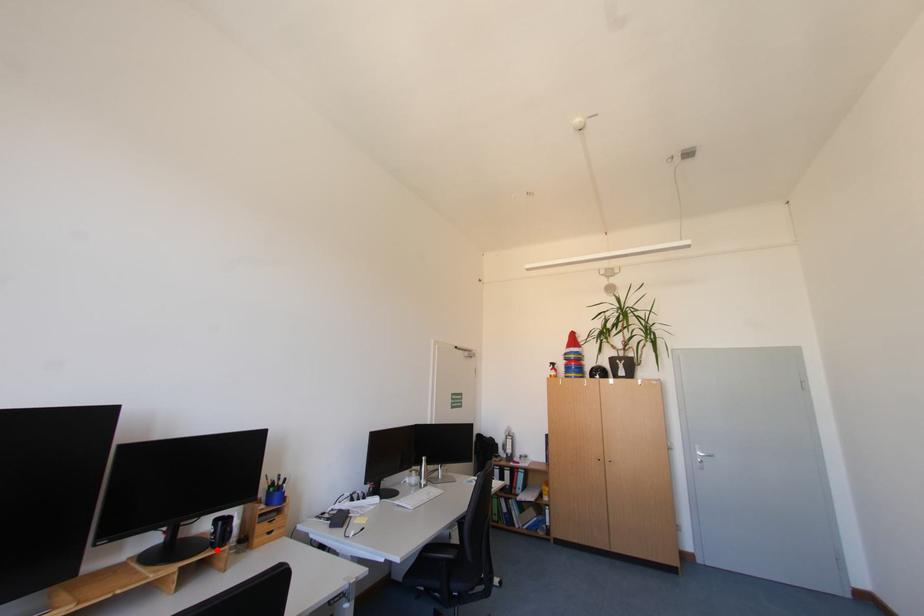
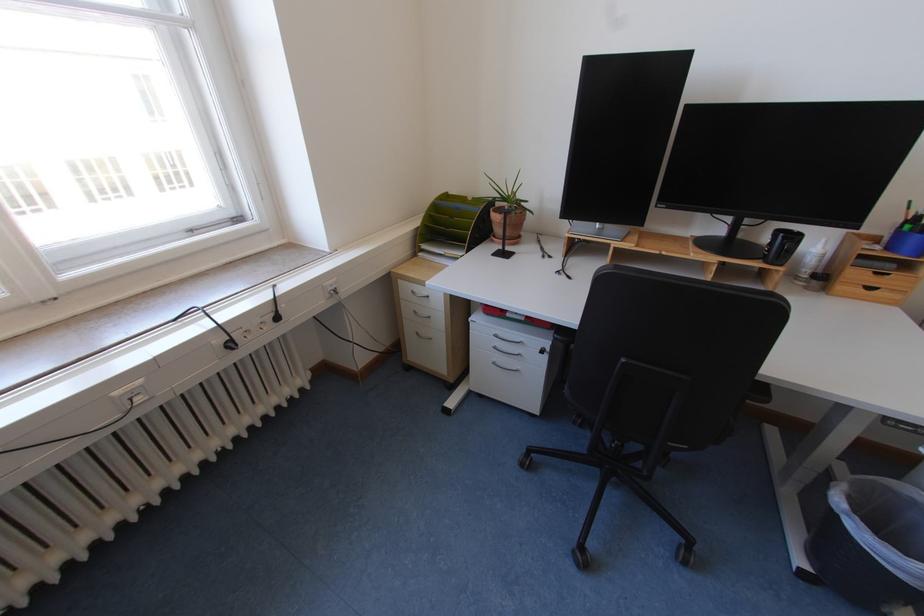
Where in the second image is the point corresponding to the highlighted location from the first image?

(769, 262)